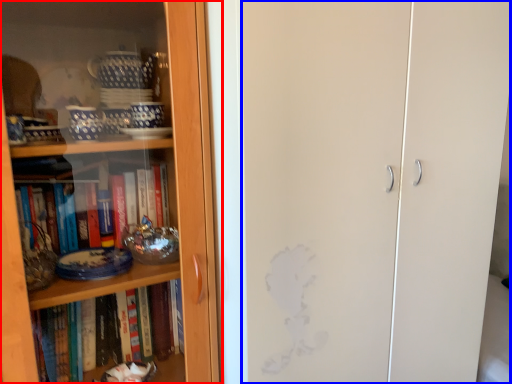
Question: Which object appears farthest to the camera in this image, bookcase (highlighted by a red box) or screen door (highlighted by a blue box)?

Choices:
 (A) bookcase
 (B) screen door

Answer: (B)